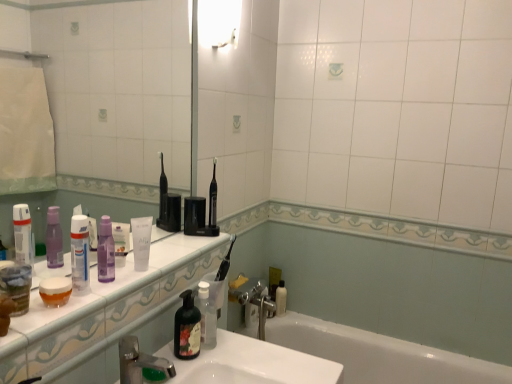
At what (x,y) coordinates should I click in order to perform the action: click on free space to the back side of purple translucent mouthwash at center, acting as the 1th mouthwash starting from the top. Please return your answer as a coordinate pair (x, y). The height and width of the screenshot is (384, 512). Looking at the image, I should click on (167, 249).